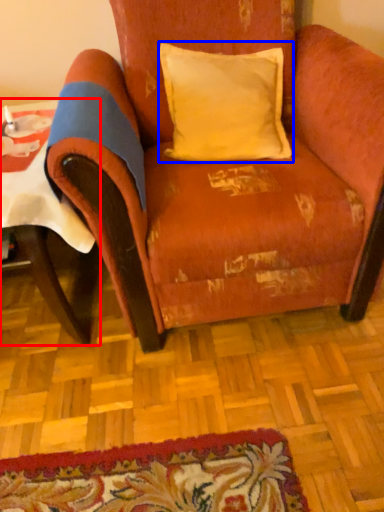
Question: Which object is closer to the camera taking this photo, table (highlighted by a red box) or pillow (highlighted by a blue box)?

Choices:
 (A) table
 (B) pillow

Answer: (A)